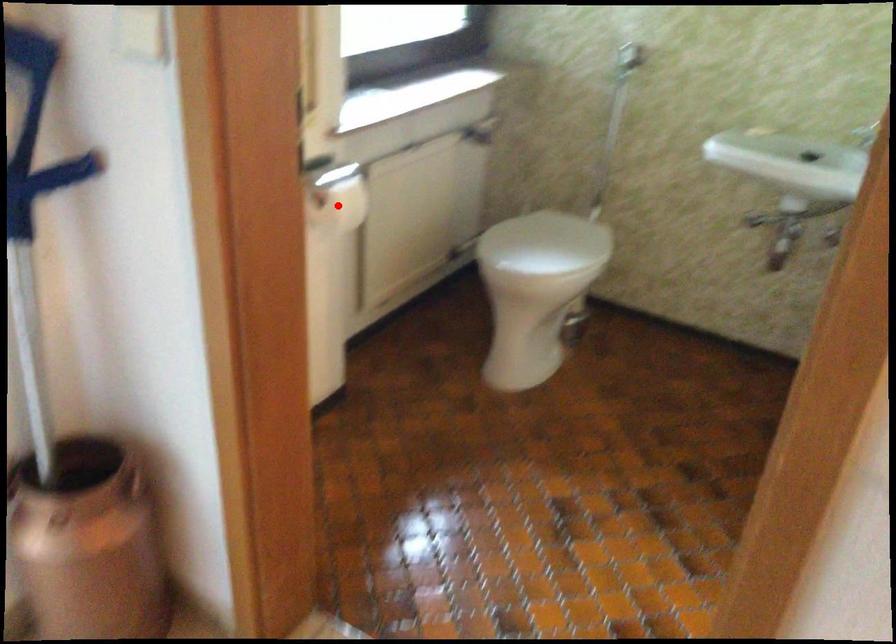
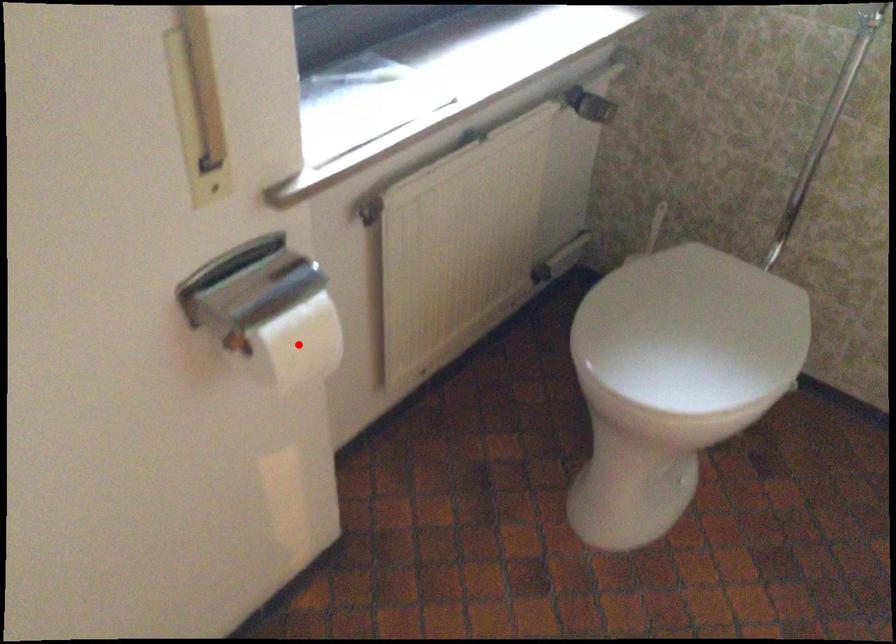
I am providing you with two images of the same scene from different viewpoints. A red point is marked on the first image and another point is marked on the second image. Does the point marked in image1 correspond to the same location as the one in image2?

Yes